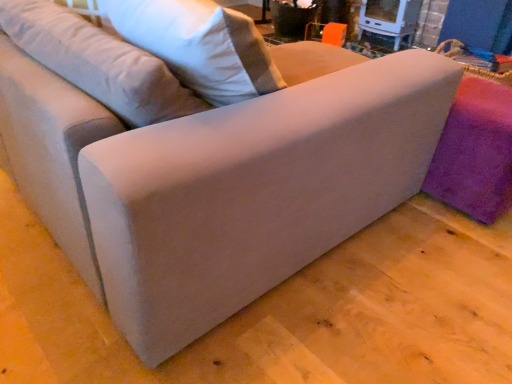
Describe the element at coordinates (326, 33) in the screenshot. I see `orange matte swivel chair at upper center` at that location.

Image resolution: width=512 pixels, height=384 pixels. What are the coordinates of `orange matte swivel chair at upper center` in the screenshot? It's located at (326, 33).

Where is `orange matte swivel chair at upper center`? The width and height of the screenshot is (512, 384). orange matte swivel chair at upper center is located at coordinates pyautogui.click(x=326, y=33).